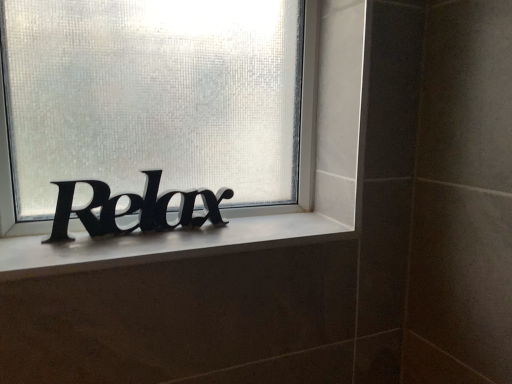
Image resolution: width=512 pixels, height=384 pixels. Find the location of `vacant area on top of white matte window sill at center (from a real-world perspective)`. vacant area on top of white matte window sill at center (from a real-world perspective) is located at coordinates (178, 233).